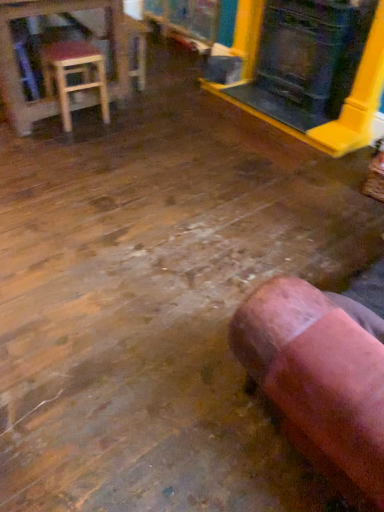
Find the location of a particular element. This screenshot has height=512, width=384. free space above wooden stool at left (from a real-world perspective) is located at coordinates (68, 48).